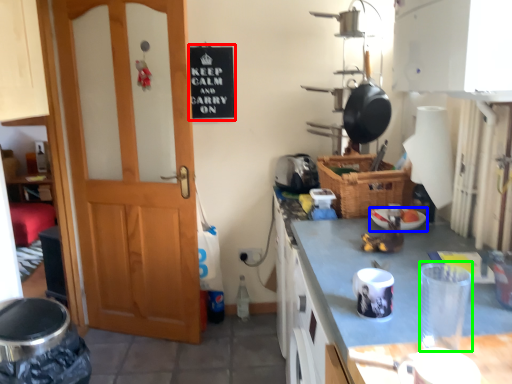
Question: Which object is positioned closest to bulletin board (highlighted by a red box)? Select from appliance (highlighted by a blue box) and appliance (highlighted by a green box).

Choices:
 (A) appliance
 (B) appliance

Answer: (A)